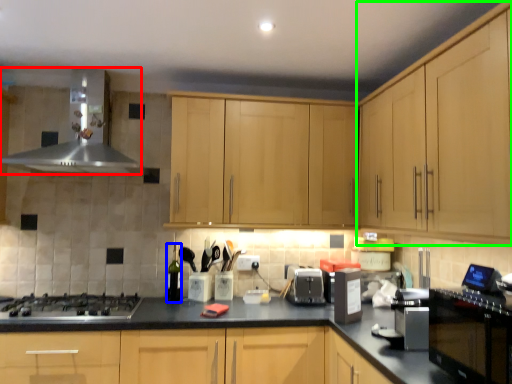
Question: Which object is the farthest from home appliance (highlighted by a red box)? Choose among these: bottle (highlighted by a blue box) or cabinetry (highlighted by a green box).

Choices:
 (A) bottle
 (B) cabinetry

Answer: (B)